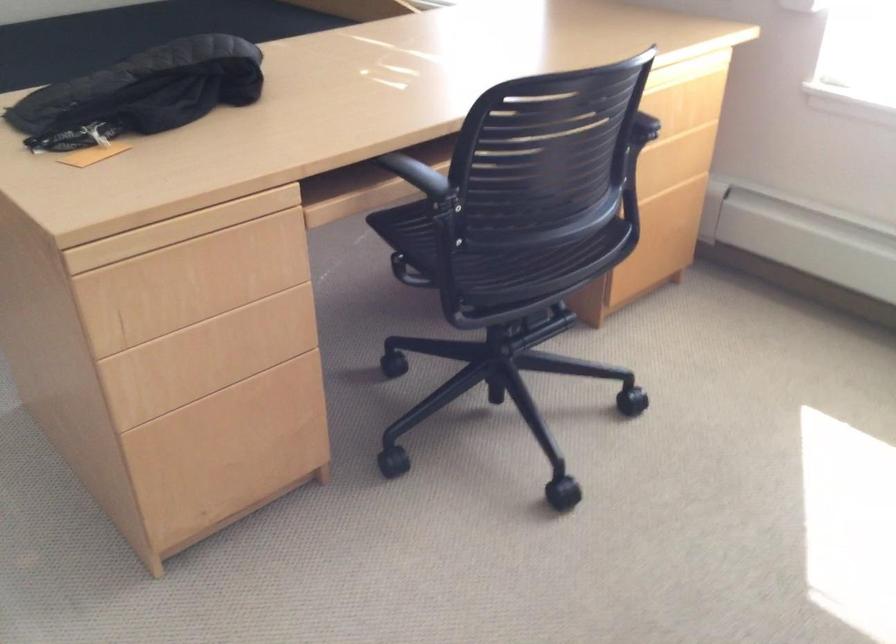
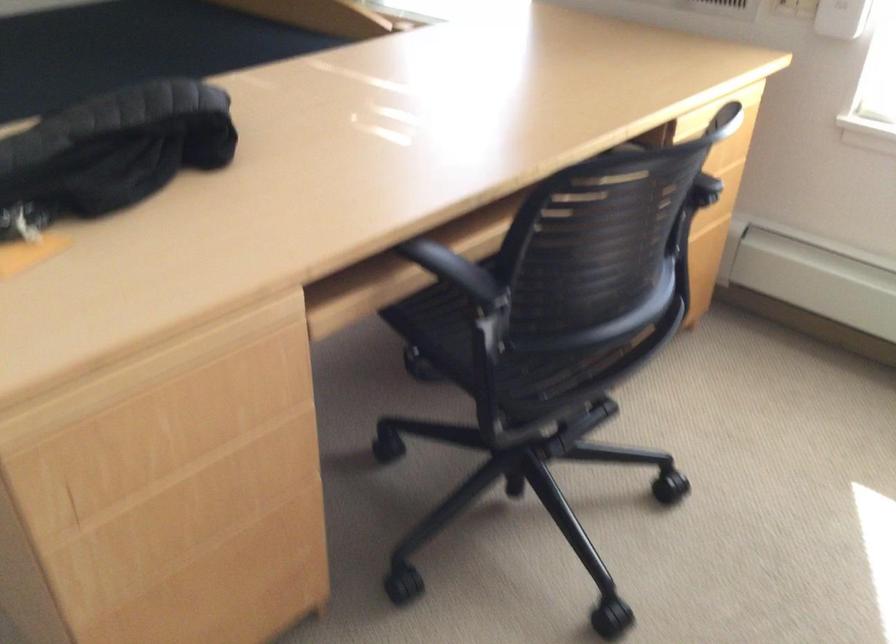
Question: The camera is either moving clockwise (left) or counter-clockwise (right) around the object. The first image is from the beginning of the video and the second image is from the end. Is the camera moving left or right when shooting the video?

Choices:
 (A) Left
 (B) Right

Answer: (A)